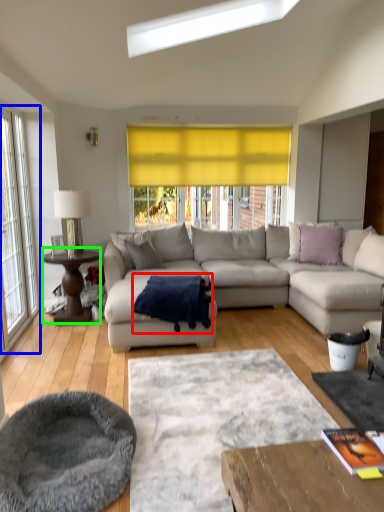
Question: Considering the real-world distances, which object is farthest from blanket (highlighted by a red box)? window (highlighted by a blue box) or coffee table (highlighted by a green box)?

Choices:
 (A) window
 (B) coffee table

Answer: (A)